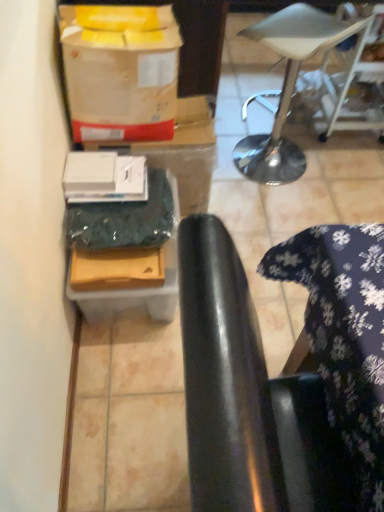
Question: From the image's perspective, is matte cardboard wrapping paper at upper left located beneath white leather stool at upper right?

Choices:
 (A) no
 (B) yes

Answer: (B)

Question: Is matte cardboard wrapping paper at upper left in contact with white leather stool at upper right?

Choices:
 (A) no
 (B) yes

Answer: (A)

Question: Does matte cardboard wrapping paper at upper left lie in front of white leather stool at upper right?

Choices:
 (A) no
 (B) yes

Answer: (B)

Question: Would you consider matte cardboard wrapping paper at upper left to be distant from white leather stool at upper right?

Choices:
 (A) yes
 (B) no

Answer: (B)

Question: Is matte cardboard wrapping paper at upper left outside white leather stool at upper right?

Choices:
 (A) no
 (B) yes

Answer: (B)

Question: From the image's perspective, relative to black leather chair at lower right, is white leather stool at upper right above or below?

Choices:
 (A) below
 (B) above

Answer: (B)

Question: Is white leather stool at upper right to the left or to the right of black leather chair at lower right in the image?

Choices:
 (A) left
 (B) right

Answer: (B)

Question: Considering the positions of white leather stool at upper right and black leather chair at lower right in the image, is white leather stool at upper right wider or thinner than black leather chair at lower right?

Choices:
 (A) wide
 (B) thin

Answer: (B)

Question: In terms of height, does white leather stool at upper right look taller or shorter compared to black leather chair at lower right?

Choices:
 (A) tall
 (B) short

Answer: (B)

Question: In terms of width, does matte green cardboard box at lower left, acting as the 2th cardboard box starting from the front, look wider or thinner when compared to matte brown cardboard box at lower left, the 1th cardboard box positioned from the front?

Choices:
 (A) wide
 (B) thin

Answer: (A)

Question: From a real-world perspective, is matte green cardboard box at lower left, which is the 1th cardboard box in back-to-front order, positioned above or below matte brown cardboard box at lower left, positioned as the 2th cardboard box in back-to-front order?

Choices:
 (A) below
 (B) above

Answer: (A)

Question: Visually, is matte green cardboard box at lower left, which is the 1th cardboard box in back-to-front order, positioned to the left or to the right of matte brown cardboard box at lower left, positioned as the 2th cardboard box in back-to-front order?

Choices:
 (A) right
 (B) left

Answer: (A)

Question: From the image's perspective, is matte green cardboard box at lower left, acting as the 2th cardboard box starting from the front, positioned above or below matte brown cardboard box at lower left, positioned as the 2th cardboard box in back-to-front order?

Choices:
 (A) below
 (B) above

Answer: (A)

Question: From the image's perspective, is white leather stool at upper right located above or below matte cardboard wrapping paper at upper left?

Choices:
 (A) above
 (B) below

Answer: (A)

Question: In terms of size, does white leather stool at upper right appear bigger or smaller than matte cardboard wrapping paper at upper left?

Choices:
 (A) big
 (B) small

Answer: (A)